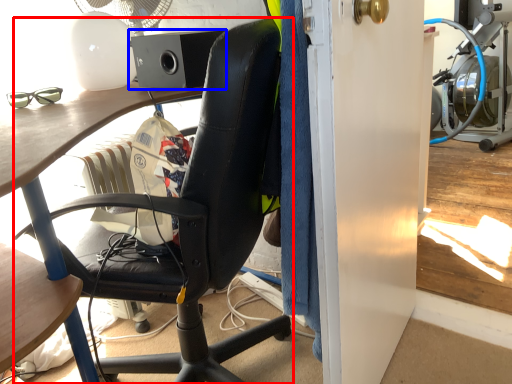
Question: Which point is closer to the camera, chair (highlighted by a red box) or loudspeaker (highlighted by a blue box)?

Choices:
 (A) chair
 (B) loudspeaker

Answer: (A)